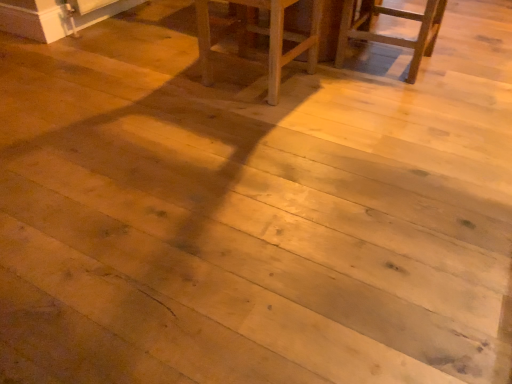
What do you see at coordinates (263, 34) in the screenshot? Image resolution: width=512 pixels, height=384 pixels. I see `wooden chair at center` at bounding box center [263, 34].

Where is `wooden chair at center`? Image resolution: width=512 pixels, height=384 pixels. wooden chair at center is located at coordinates (263, 34).

At what (x,y) coordinates should I click in order to perform the action: click on wooden chair at upper right. Please return your answer as a coordinate pair (x, y). Looking at the image, I should click on (390, 36).

Describe the element at coordinates (390, 36) in the screenshot. I see `wooden chair at upper right` at that location.

Identify the location of wooden chair at center. (263, 34).

Considering the relative positions of wooden chair at center and wooden chair at upper right in the image provided, is wooden chair at center to the left or to the right of wooden chair at upper right?

From the image, it's evident that wooden chair at center is to the left of wooden chair at upper right.

Considering the relative positions of wooden chair at center and wooden chair at upper right in the image provided, is wooden chair at center in front of wooden chair at upper right?

That is True.

Between point (238, 34) and point (404, 39), which one is positioned in front?

The point (404, 39) is in front.

From the image's perspective, would you say wooden chair at center is positioned over wooden chair at upper right?

Incorrect, from the image's perspective, wooden chair at center is lower than wooden chair at upper right.

From a real-world perspective, between wooden chair at center and wooden chair at upper right, who is vertically higher?

wooden chair at center.

Is wooden chair at center wider than wooden chair at upper right?

In fact, wooden chair at center might be narrower than wooden chair at upper right.

Which of these two, wooden chair at center or wooden chair at upper right, stands shorter?

wooden chair at upper right is shorter.

Between wooden chair at center and wooden chair at upper right, which one has smaller size?

With smaller size is wooden chair at upper right.

Looking at this image, is wooden chair at center located outside wooden chair at upper right?

Yes, wooden chair at center is located beyond the bounds of wooden chair at upper right.

Would you say wooden chair at center is a long distance from wooden chair at upper right?

That's not correct — wooden chair at center is a little close to wooden chair at upper right.

Could you tell me if wooden chair at center is facing wooden chair at upper right?

No, wooden chair at center is not facing towards wooden chair at upper right.

How many degrees apart are the facing directions of wooden chair at center and wooden chair at upper right?

The angular difference between wooden chair at center and wooden chair at upper right is 90.5 degrees.

You are a GUI agent. You are given a task and a screenshot of the screen. Output one action in this format:
    pyautogui.click(x=<x>, y=<y>)
    Task: Click on the chair below the wooden chair at center (from a real-world perspective)
    
    Given the screenshot: What is the action you would take?
    pyautogui.click(x=390, y=36)

Is wooden chair at upper right to the right of wooden chair at center from the viewer's perspective?

Indeed, wooden chair at upper right is positioned on the right side of wooden chair at center.

Is wooden chair at upper right further to camera compared to wooden chair at center?

Yes, wooden chair at upper right is further from the camera.

Is point (424, 16) closer or farther from the camera than point (283, 26)?

Point (424, 16).

From the image's perspective, which is above, wooden chair at upper right or wooden chair at center?

wooden chair at upper right appears higher in the image.

From the picture: From a real-world perspective, is wooden chair at upper right on top of wooden chair at center?

No, from a real-world perspective, wooden chair at upper right is not on top of wooden chair at center.

Is wooden chair at upper right wider than wooden chair at center?

Yes, wooden chair at upper right is wider than wooden chair at center.

Considering the relative sizes of wooden chair at upper right and wooden chair at center in the image provided, is wooden chair at upper right shorter than wooden chair at center?

Correct, wooden chair at upper right is not as tall as wooden chair at center.

Considering the sizes of wooden chair at upper right and wooden chair at center in the image, is wooden chair at upper right bigger or smaller than wooden chair at center?

Considering their sizes, wooden chair at upper right takes up less space than wooden chair at center.

Is wooden chair at upper right not inside wooden chair at center?

Absolutely, wooden chair at upper right is external to wooden chair at center.

Based on the photo, are wooden chair at upper right and wooden chair at center beside each other?

No, wooden chair at upper right is not with wooden chair at center.

Could you tell me if wooden chair at upper right is facing wooden chair at center?

No, wooden chair at upper right does not turn towards wooden chair at center.

Consider the image. Can you tell me how much wooden chair at upper right and wooden chair at center differ in facing direction?

They differ by 90.5 degrees in their facing directions.

How distant is wooden chair at upper right from wooden chair at center?

The distance of wooden chair at upper right from wooden chair at center is 15.68 inches.

Find the location of a particular element. The image size is (512, 384). furniture that is below the wooden chair at upper right (from the image's perspective) is located at coordinates (263, 34).

You are a GUI agent. You are given a task and a screenshot of the screen. Output one action in this format:
    pyautogui.click(x=<x>, y=<y>)
    Task: Click on the furniture below the wooden chair at upper right (from the image's perspective)
    This screenshot has width=512, height=384.
    Given the screenshot: What is the action you would take?
    pyautogui.click(x=263, y=34)

I want to click on chair located behind the wooden chair at center, so click(x=390, y=36).